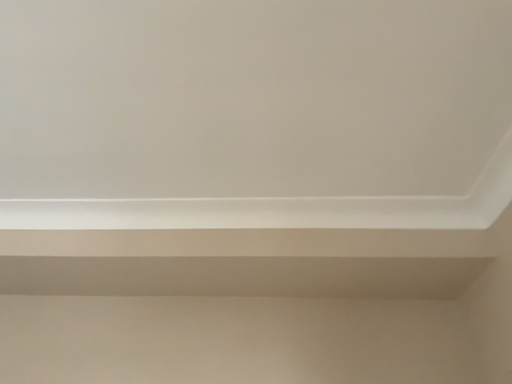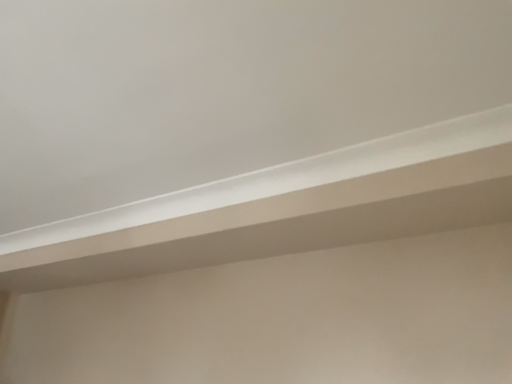
Question: Which way did the camera rotate in the video?

Choices:
 (A) rotated upward
 (B) rotated downward

Answer: (B)